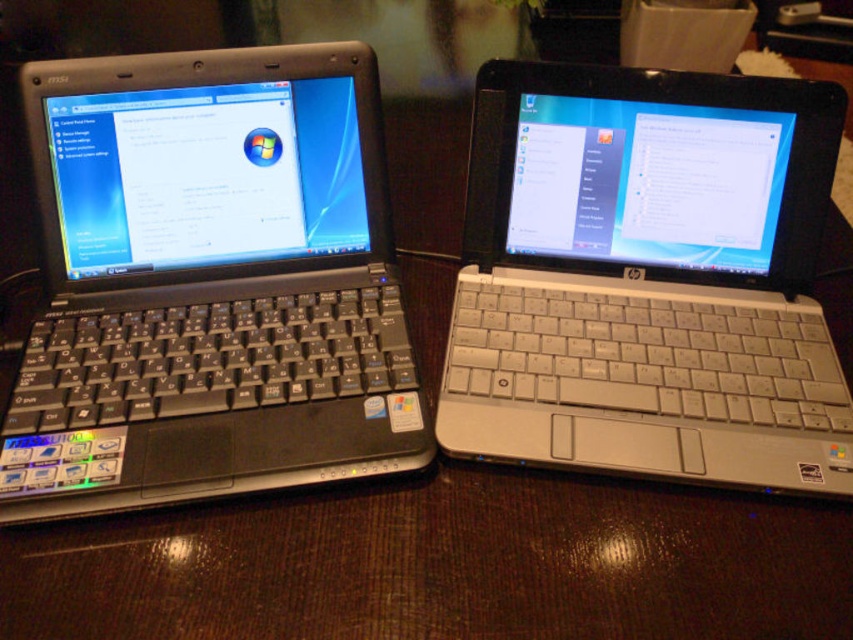
You are setting up a workspace and need to place a monitor on top of the black plastic table at center. The monitor requires a surface that is at least 2 inches tall to avoid overheating. Can the silver matte laptop at center help provide the necessary height when placed under the monitor?

The silver matte laptop at center is taller than the black plastic table at center. Placing the monitor on top of the silver matte laptop at center would provide the required height to avoid overheating.

You are setting up a workspace and need to place a new monitor on the desk. The monitor requires a space that is at least 10 cm above the black plastic table at center. Can the matte black laptop at left be placed under the monitor without blocking the table surface?

The matte black laptop at left is located above the black plastic table at center, so placing it under the monitor would still keep it on the table surface. However, the required clearance of 10 cm above the table must be maintained. Since the laptop itself occupies space above the table, ensure that the combined height of the laptop and monitor does not exceed the required clearance. If the laptop is under the monitor, the total height from the table must be at least 10 cm.

You are setting up a workspace and need to place both the matte black laptop at left and the silver matte laptop at center on a shelf. The shelf has limited space, and you want to know which laptop takes up more space. Which laptop should you consider placing first to optimize space?

The matte black laptop at left is larger in size than the silver matte laptop at center, so you should place the matte black laptop at left first to accommodate its larger size before placing the smaller one.